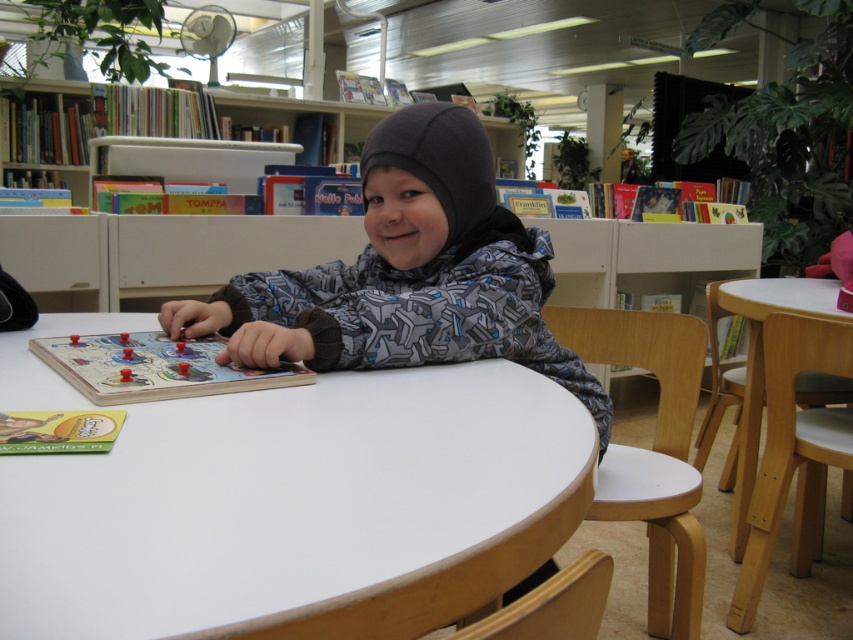
Question: Which of these objects is positioned farthest from the white plastic bookshelf at upper center?

Choices:
 (A) white wooden table at center
 (B) gray fleece jacket at center
 (C) wooden table at lower right
 (D) wooden board game at center

Answer: (A)

Question: Is white wooden table at center below wooden board game at center?

Choices:
 (A) no
 (B) yes

Answer: (B)

Question: Estimate the real-world distances between objects in this image. Which object is farther from the white plastic bookshelf at upper center?

Choices:
 (A) white wooden table at center
 (B) wooden table at lower right
 (C) gray fleece jacket at center

Answer: (A)

Question: From the image, what is the correct spatial relationship of gray fleece jacket at center in relation to white plastic bookshelf at upper center?

Choices:
 (A) below
 (B) above

Answer: (A)

Question: Estimate the real-world distances between objects in this image. Which object is farther from the wooden board game at center?

Choices:
 (A) gray fleece jacket at center
 (B) white plastic bookshelf at upper center
 (C) wooden table at lower right
 (D) white wooden table at center

Answer: (C)

Question: Does white wooden table at center appear over wooden table at lower right?

Choices:
 (A) yes
 (B) no

Answer: (A)